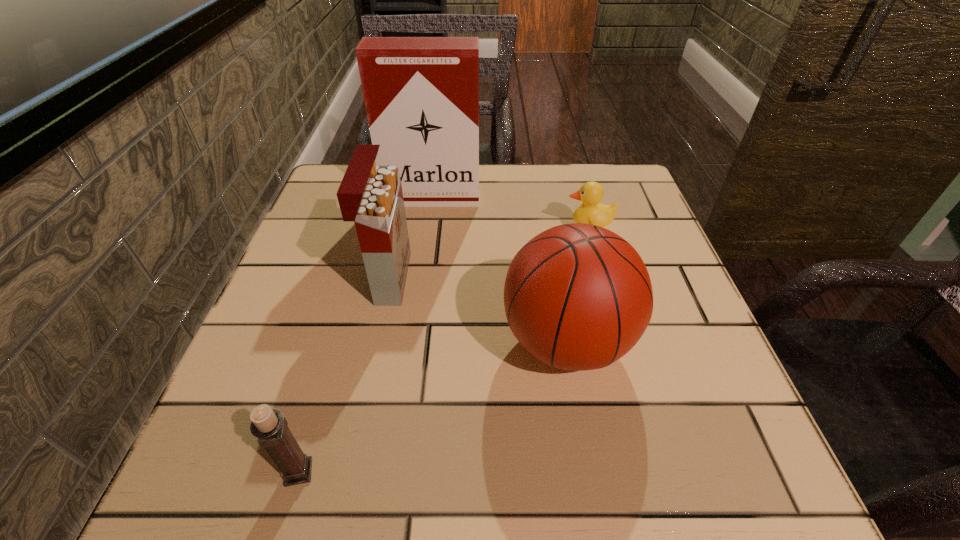
Where is `free space between the nearest object and the shorter cigarette case`? free space between the nearest object and the shorter cigarette case is located at coordinates (344, 375).

Locate an element on the screen. The height and width of the screenshot is (540, 960). empty location between the taller cigarette case and the second shortest object is located at coordinates (366, 335).

The image size is (960, 540). I want to click on free point between the fourth tallest object and the basketball, so click(x=432, y=407).

This screenshot has width=960, height=540. I want to click on free point between the basketball and the nearest object, so click(x=432, y=407).

The height and width of the screenshot is (540, 960). In order to click on vacant area between the candle holder and the farther cigarette case in this screenshot , I will do `click(366, 335)`.

Where is `free space that is in between the candle holder and the basketball`? free space that is in between the candle holder and the basketball is located at coordinates (432, 407).

You are a GUI agent. You are given a task and a screenshot of the screen. Output one action in this format:
    pyautogui.click(x=<x>, y=<y>)
    Task: Click on the vacant point located between the nearer cigarette case and the shortest object
    The height and width of the screenshot is (540, 960).
    Given the screenshot: What is the action you would take?
    coord(489,254)

The width and height of the screenshot is (960, 540). Find the location of `free space between the taller cigarette case and the nearer cigarette case`. free space between the taller cigarette case and the nearer cigarette case is located at coordinates (411, 238).

Locate an element on the screen. Image resolution: width=960 pixels, height=540 pixels. object that stands as the second closest to the fourth nearest object is located at coordinates (421, 94).

Identify the location of object that is the third closest to the basketball. (269, 425).